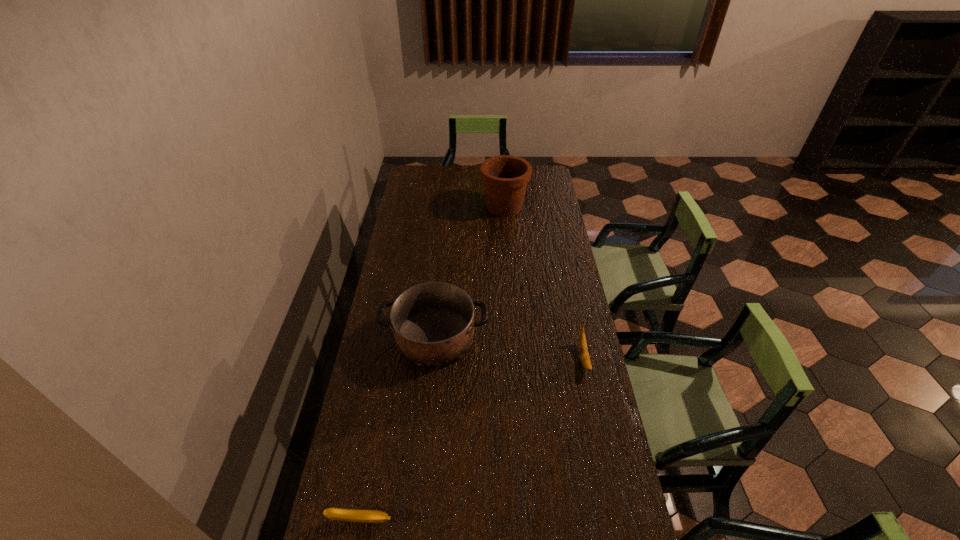
The image size is (960, 540). I want to click on saucepan that is at the left edge, so click(x=433, y=323).

You are a GUI agent. You are given a task and a screenshot of the screen. Output one action in this format:
    pyautogui.click(x=<x>, y=<y>)
    Task: Click on the banana located at the left edge
    The image size is (960, 540).
    Given the screenshot: What is the action you would take?
    click(x=369, y=516)

Find the location of `flowerpot situated at the right edge`. flowerpot situated at the right edge is located at coordinates (505, 177).

This screenshot has width=960, height=540. Identify the location of banana at the right edge. pos(583,349).

Locate an element on the screen. vacant space at the left edge is located at coordinates (358, 438).

Where is `vacant space at the right edge of the desktop`? This screenshot has width=960, height=540. vacant space at the right edge of the desktop is located at coordinates (576, 394).

Find the location of a particular element. This screenshot has width=960, height=540. vacant space at the far left corner is located at coordinates (424, 168).

The height and width of the screenshot is (540, 960). Find the location of `vacant space that's between the flowerpot and the rightmost object`. vacant space that's between the flowerpot and the rightmost object is located at coordinates (544, 282).

Locate an element on the screen. Image resolution: width=960 pixels, height=540 pixels. vacant space that is in between the farther banana and the third shortest object is located at coordinates (509, 347).

This screenshot has width=960, height=540. What are the coordinates of `vacant area between the saucepan and the shorter banana` in the screenshot? It's located at (398, 428).